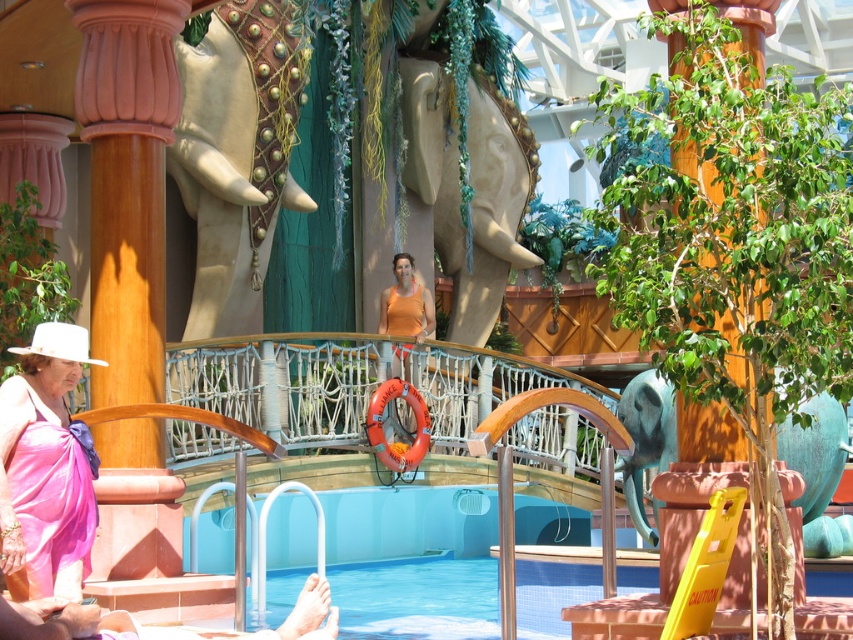
The width and height of the screenshot is (853, 640). Describe the element at coordinates (45, 468) in the screenshot. I see `pink satin dress at lower left` at that location.

Is pink satin dress at lower left further to the viewer compared to green leafy plant at center?

Yes, pink satin dress at lower left is behind green leafy plant at center.

What do you see at coordinates (45, 468) in the screenshot? The width and height of the screenshot is (853, 640). I see `pink satin dress at lower left` at bounding box center [45, 468].

The height and width of the screenshot is (640, 853). Identify the location of pink satin dress at lower left. (45, 468).

Who is more forward, (99,22) or (84,333)?

Point (84,333) is in front.

Is point (137, 444) positioned in front of point (82, 536)?

No.

Which is behind, point (94, 268) or point (39, 392)?

The point (94, 268) is behind.

Locate an element on the screen. The width and height of the screenshot is (853, 640). pink wood column at left is located at coordinates (126, 182).

Does point (102, 564) come behind point (688, 173)?

Yes, point (102, 564) is farther from viewer.

Between point (108, 332) and point (763, 493), which one is positioned behind?

The point (108, 332) is behind.

Between point (149, 285) and point (764, 470), which one is positioned in front?

Point (764, 470) is more forward.

This screenshot has height=640, width=853. Find the location of `pink wood column at left`. pink wood column at left is located at coordinates (126, 182).